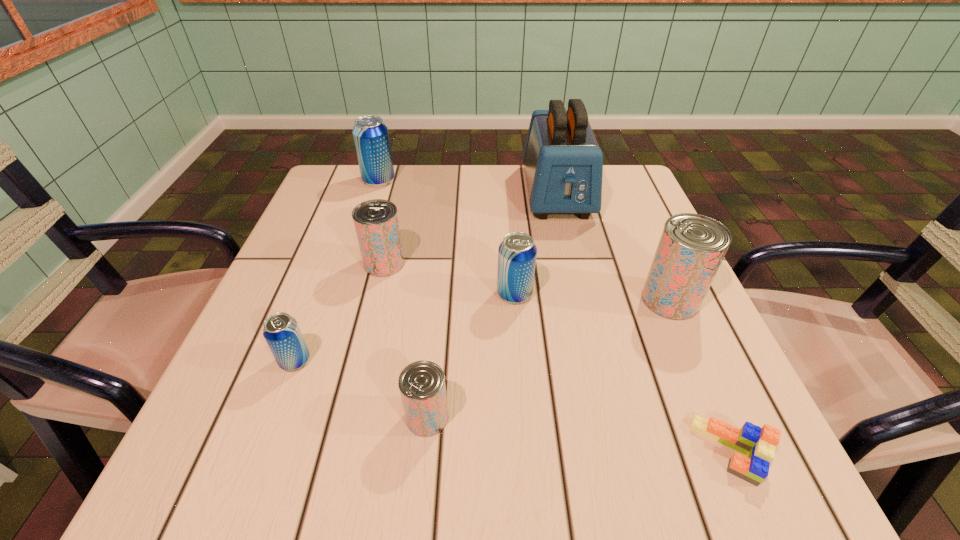
Identify the location of free space between the nearest blue beer can and the fifth object from left to right. Image resolution: width=960 pixels, height=540 pixels. (405, 327).

What are the coordinates of `unoccupied area between the toaster and the nearest red beer can` in the screenshot? It's located at (492, 305).

This screenshot has height=540, width=960. What are the coordinates of `unoccupied position between the farthest red beer can and the nearest beer can` in the screenshot? It's located at point(406,340).

Where is `free space between the sixth farthest object and the rightmost beer can`? free space between the sixth farthest object and the rightmost beer can is located at coordinates (483, 330).

At what (x,y) coordinates should I click in order to perform the action: click on free spot between the shortest object and the second nearest red beer can. Please return your answer as a coordinate pair (x, y). Looking at the image, I should click on (700, 375).

Locate an element on the screen. free space between the sixth nearest object and the rightmost blue beer can is located at coordinates (449, 279).

Image resolution: width=960 pixels, height=540 pixels. I want to click on unoccupied area between the fourth beer can from left to right and the second biggest red beer can, so click(x=406, y=340).

At what (x,y) coordinates should I click in order to perform the action: click on free space between the farthest blue beer can and the rightmost blue beer can. Please return your answer as a coordinate pair (x, y). This screenshot has height=540, width=960. Looking at the image, I should click on (446, 238).

You are a GUI agent. You are given a task and a screenshot of the screen. Output one action in this format:
    pyautogui.click(x=<x>, y=<y>)
    Task: Click on the free space that is in between the second smallest blue beer can and the biggest red beer can
    
    Given the screenshot: What is the action you would take?
    pyautogui.click(x=592, y=297)

This screenshot has height=540, width=960. In order to click on object identified as the closest to the second smallest blue beer can in this screenshot , I will do `click(376, 223)`.